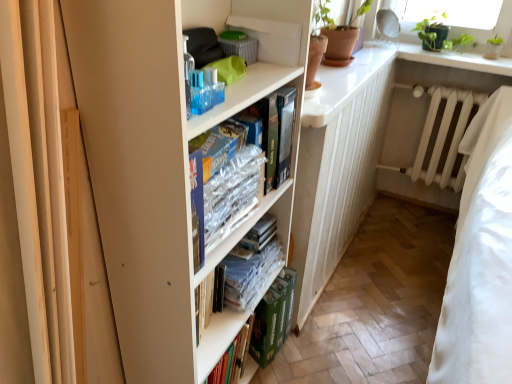
Question: Is white matte radiator at center at the left side of white matte bookcase at center?

Choices:
 (A) no
 (B) yes

Answer: (A)

Question: Does white matte radiator at center have a lesser height compared to white matte bookcase at center?

Choices:
 (A) no
 (B) yes

Answer: (B)

Question: Considering the relative sizes of white matte radiator at center and white matte bookcase at center in the image provided, is white matte radiator at center bigger than white matte bookcase at center?

Choices:
 (A) no
 (B) yes

Answer: (A)

Question: Is white matte radiator at center facing towards white matte bookcase at center?

Choices:
 (A) no
 (B) yes

Answer: (B)

Question: Does white matte radiator at center come in front of white matte bookcase at center?

Choices:
 (A) no
 (B) yes

Answer: (A)

Question: From the image's perspective, is white matte radiator at center on top of white matte bookcase at center?

Choices:
 (A) no
 (B) yes

Answer: (B)

Question: Is transparent plastic bottle at upper center bigger than green cardboard book at lower center?

Choices:
 (A) no
 (B) yes

Answer: (A)

Question: Does transparent plastic bottle at upper center have a smaller size compared to green cardboard book at lower center?

Choices:
 (A) yes
 (B) no

Answer: (A)

Question: Considering the relative sizes of transparent plastic bottle at upper center and green cardboard book at lower center in the image provided, is transparent plastic bottle at upper center thinner than green cardboard book at lower center?

Choices:
 (A) no
 (B) yes

Answer: (B)

Question: Is green cardboard book at lower center at the back of transparent plastic bottle at upper center?

Choices:
 (A) yes
 (B) no

Answer: (B)

Question: From the image's perspective, is transparent plastic bottle at upper center located above green cardboard book at lower center?

Choices:
 (A) yes
 (B) no

Answer: (A)

Question: Could you tell me if transparent plastic bottle at upper center is turned towards green cardboard book at lower center?

Choices:
 (A) yes
 (B) no

Answer: (B)

Question: Considering the relative sizes of white glossy counter top at upper right and clear plastic books at center, which ranks as the first book in bottom-to-top order, in the image provided, is white glossy counter top at upper right thinner than clear plastic books at center, which ranks as the first book in bottom-to-top order,?

Choices:
 (A) yes
 (B) no

Answer: (B)